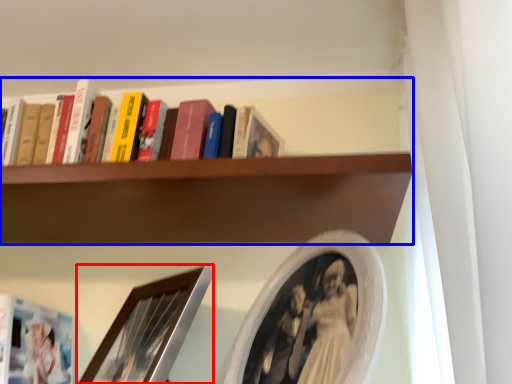
Question: Among these objects, which one is farthest to the camera, picture frame (highlighted by a red box) or shelf (highlighted by a blue box)?

Choices:
 (A) picture frame
 (B) shelf

Answer: (B)